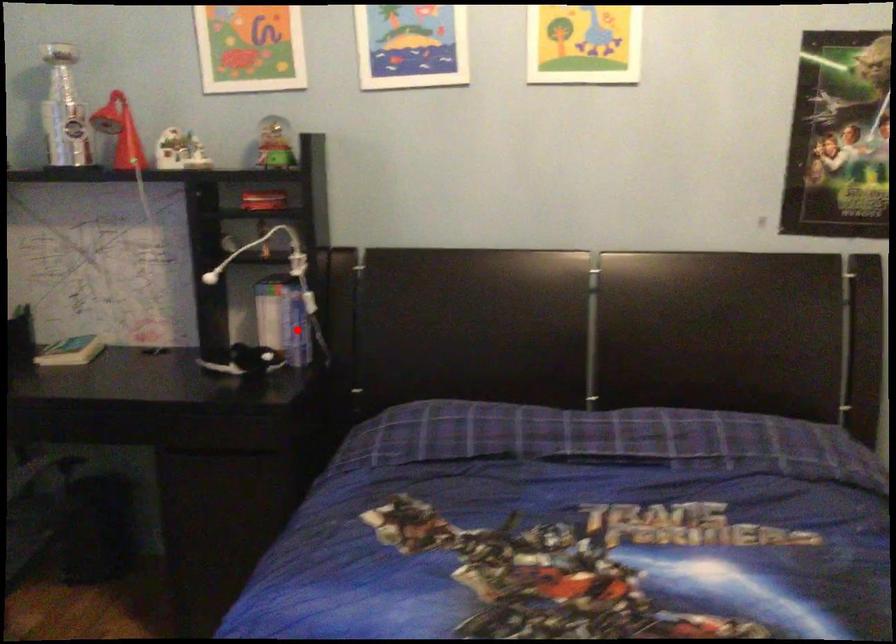
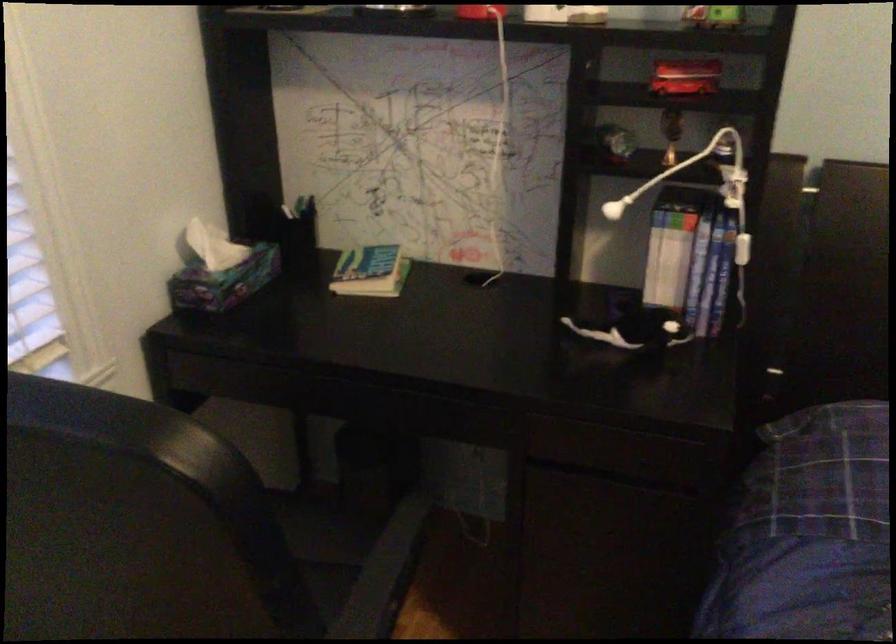
Question: I am providing you with two images of the same scene from different viewpoints. Given a red point in image1, look at the same physical point in image2. Is it:

Choices:
 (A) Closer to the viewpoint
 (B) Farther from the viewpoint

Answer: (A)